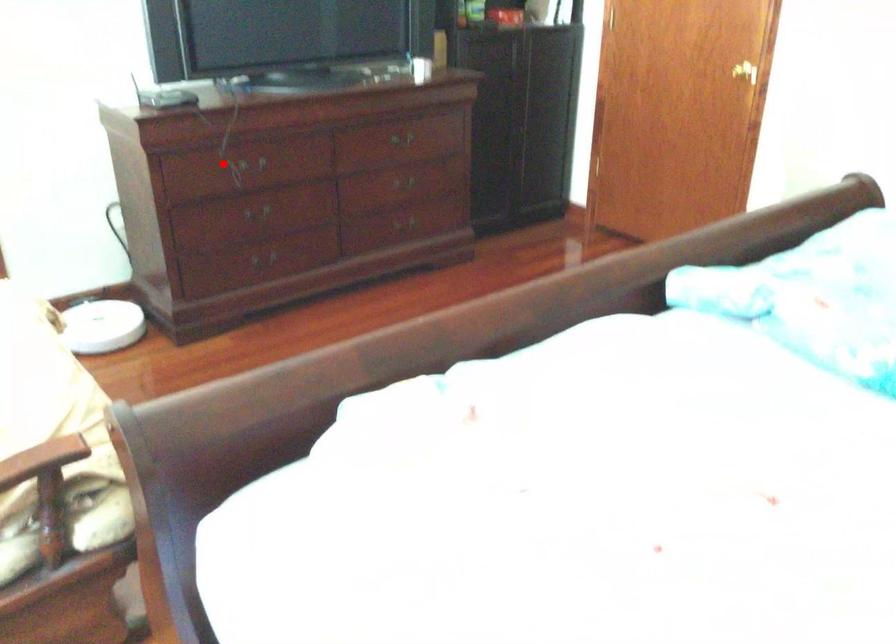
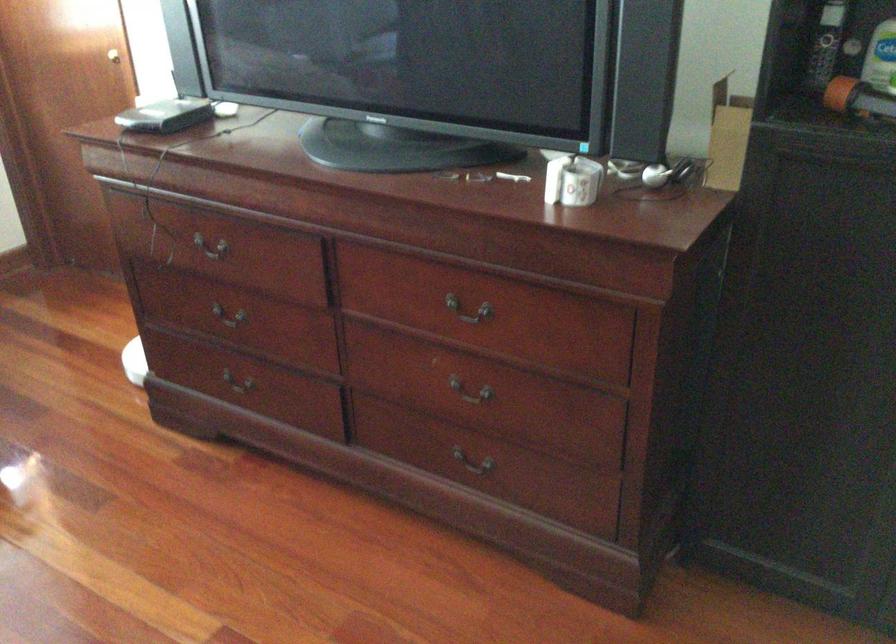
Locate, in the second image, the point that corresponds to the highlighted location in the first image.

(211, 241)